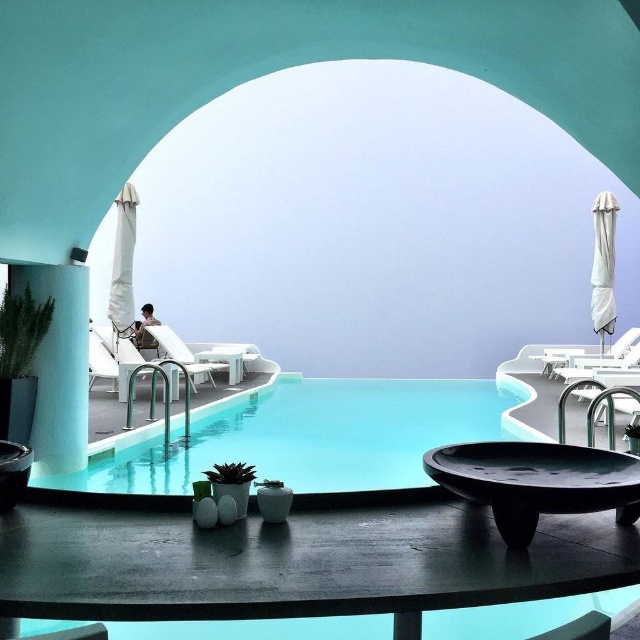
You are a guest at this pool area and want to place a small drink on the matte black bowl at center without it falling off. Considering the white plastic chair at center is nearby, which object should you use as a stable base for your drink?

The matte black bowl at center is positioned on the right side of the white plastic chair at center. Since the bowl is likely a solid surface, it would be the stable base for the drink rather than the chair.

You are a guest at this poolside area and want to place your towel on the closest table to the pool. Which table should you choose between the smooth dark wood table at lower center and the matte white table at center?

The smooth dark wood table at lower center is closer to the pool since it is positioned over the matte white table at center, meaning it is nearer to the pool area.

You are a delivery person who needs to place a large package that is 2 meters long between the smooth dark wood table at lower center and the matte white table at center. Is there enough space between them to place the package without moving either table?

The distance between the smooth dark wood table at lower center and the matte white table at center is 8.65 meters. Since the package is only 2 meters long, there is sufficient space to place it between them without moving either table.